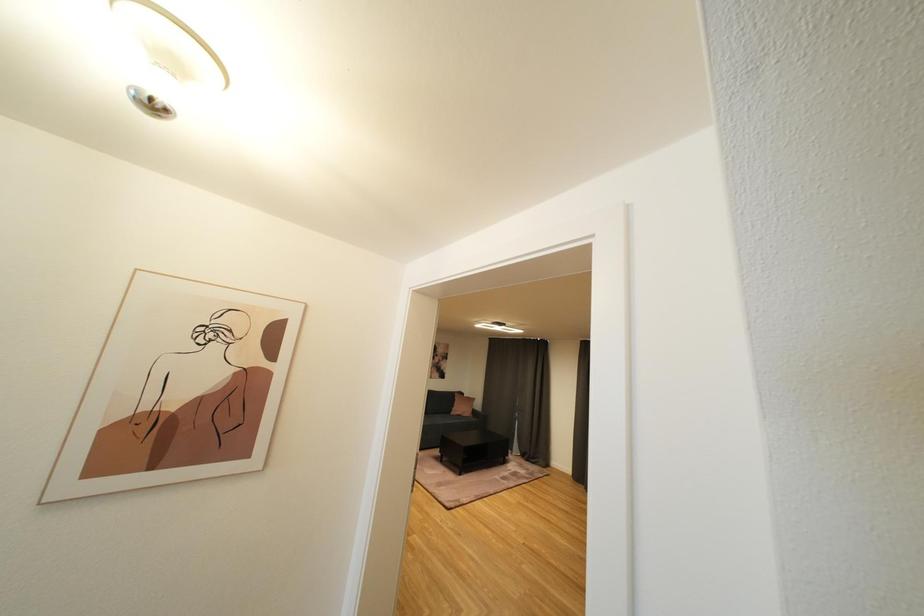
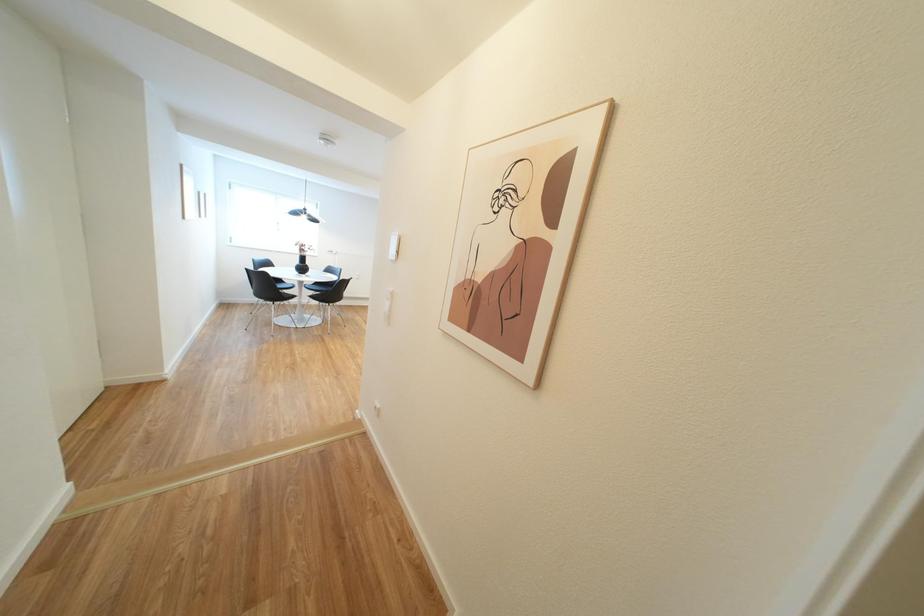
Question: The images are taken continuously from a first-person perspective. In which direction is your viewpoint rotating?

Choices:
 (A) Left
 (B) Right
 (C) Up
 (D) Down

Answer: (A)